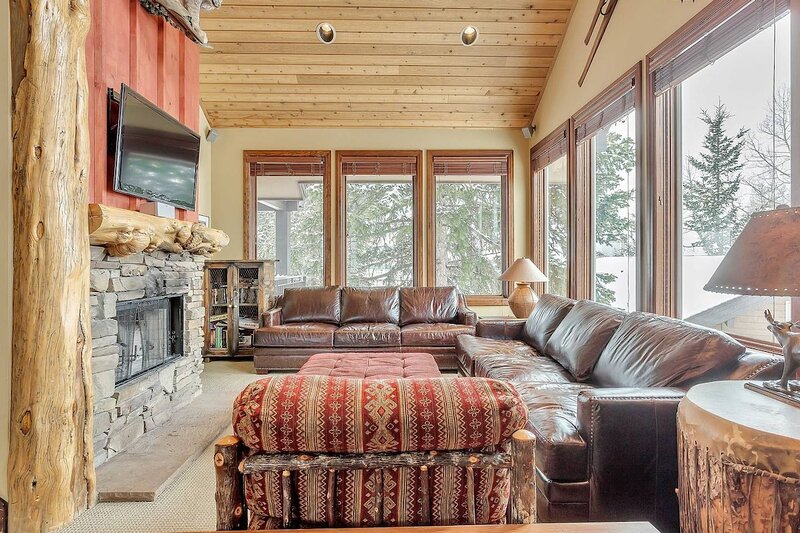
At what (x,y) coordinates should I click in order to perform the action: click on couch. Please return your answer as a coordinate pair (x, y). The height and width of the screenshot is (533, 800). Looking at the image, I should click on (433, 431).